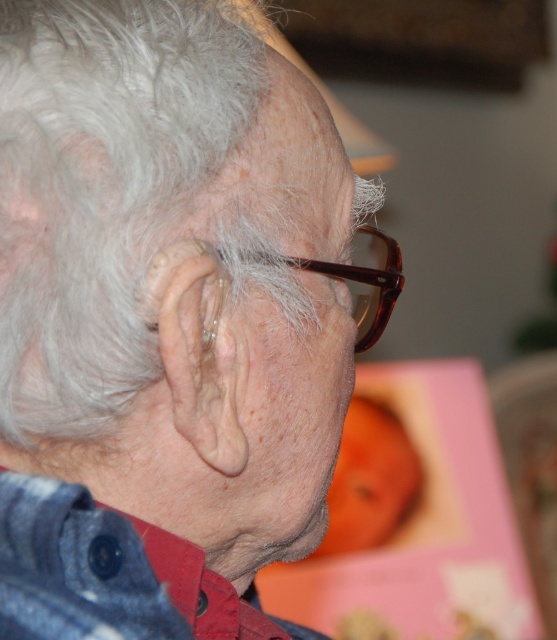
Question: Which object appears closest to the camera in this image?

Choices:
 (A) brown tortoiseshell glasses at center
 (B) matte brown glasses at center

Answer: (B)

Question: From the image, what is the correct spatial relationship of matte brown glasses at center in relation to brown tortoiseshell glasses at center?

Choices:
 (A) above
 (B) below

Answer: (B)

Question: Can you confirm if matte brown glasses at center is wider than brown tortoiseshell glasses at center?

Choices:
 (A) no
 (B) yes

Answer: (B)

Question: Which object is closer to the camera taking this photo?

Choices:
 (A) matte brown glasses at center
 (B) brown tortoiseshell glasses at center

Answer: (A)

Question: Can you confirm if matte brown glasses at center is positioned to the right of brown tortoiseshell glasses at center?

Choices:
 (A) no
 (B) yes

Answer: (A)